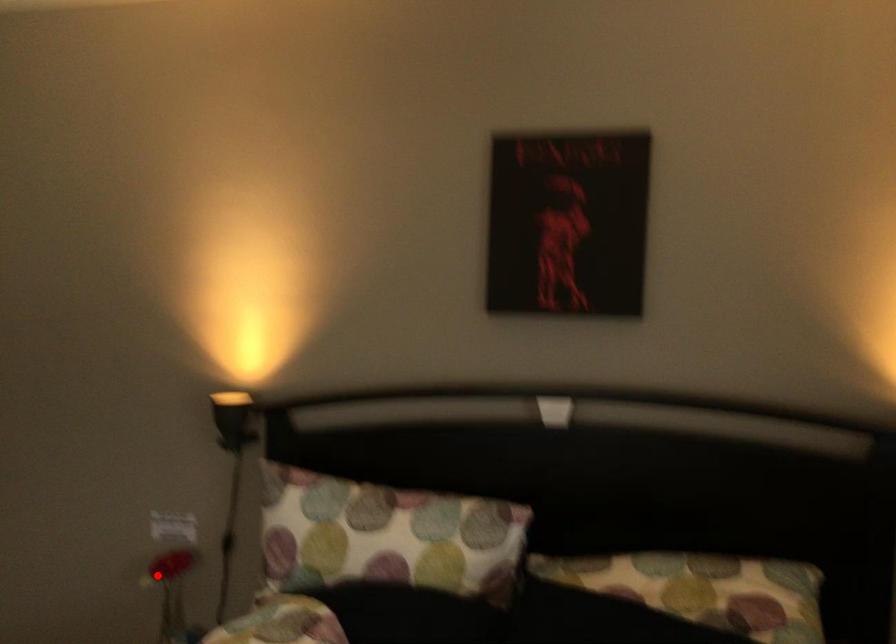
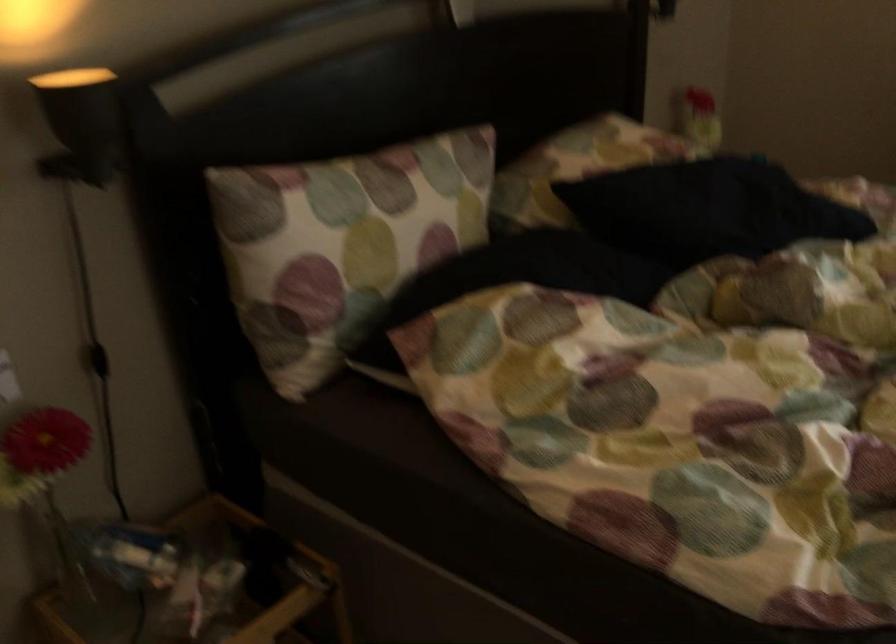
In the second image, find the point that corresponds to the highlighted location in the first image.

(46, 480)